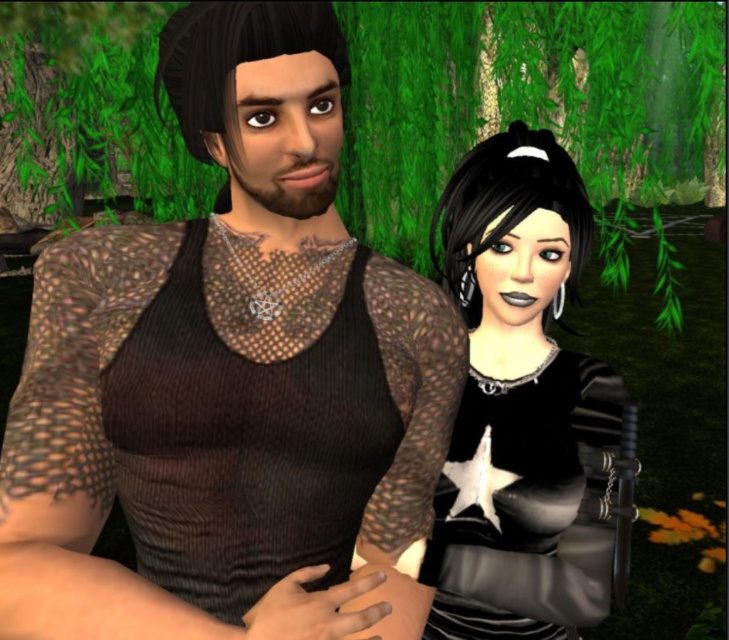
Question: Which point is closer to the camera?

Choices:
 (A) matte black mesh tank top at center
 (B) black leather dress at right

Answer: (A)

Question: Does matte black mesh tank top at center appear over black leather dress at right?

Choices:
 (A) no
 (B) yes

Answer: (B)

Question: Can you confirm if matte black mesh tank top at center is positioned to the right of black leather dress at right?

Choices:
 (A) no
 (B) yes

Answer: (A)

Question: Can you confirm if matte black mesh tank top at center is smaller than black leather dress at right?

Choices:
 (A) no
 (B) yes

Answer: (B)